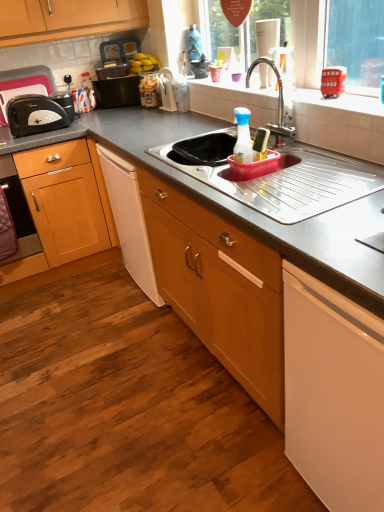
At what (x,y) coordinates should I click in order to perform the action: click on blank space to the left of white plastic dish rack at upper center, marked as the first appliance in a right-to-left arrangement. Please return your answer as a coordinate pair (x, y). Looking at the image, I should click on (149, 110).